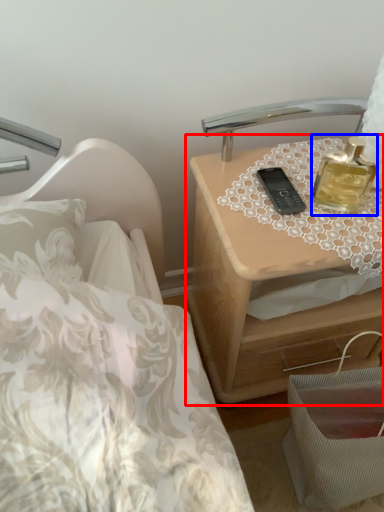
Question: Which object appears farthest to the camera in this image, nightstand (highlighted by a red box) or perfume (highlighted by a blue box)?

Choices:
 (A) nightstand
 (B) perfume

Answer: (A)